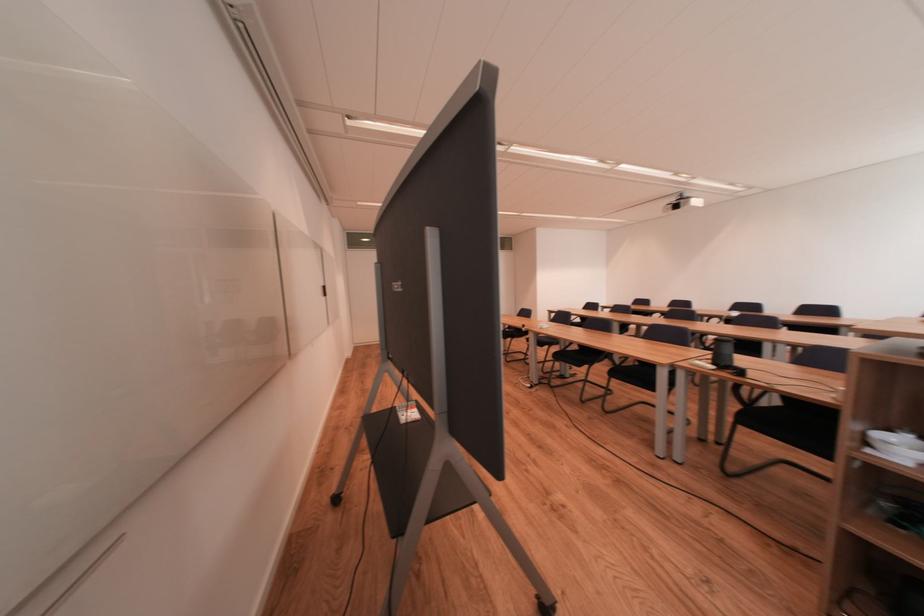
The width and height of the screenshot is (924, 616). What are the coordinates of `white remote control` in the screenshot? It's located at (407, 411).